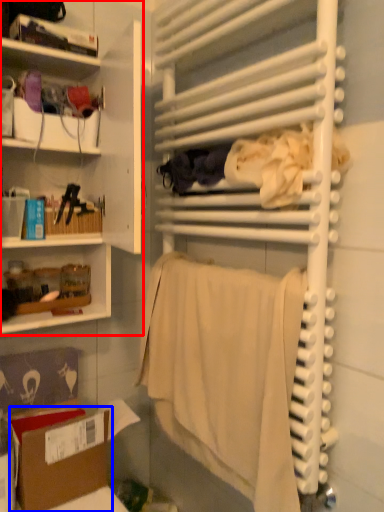
Question: Which object appears closest to the camera in this image, shelf (highlighted by a red box) or cardboard box (highlighted by a blue box)?

Choices:
 (A) shelf
 (B) cardboard box

Answer: (A)